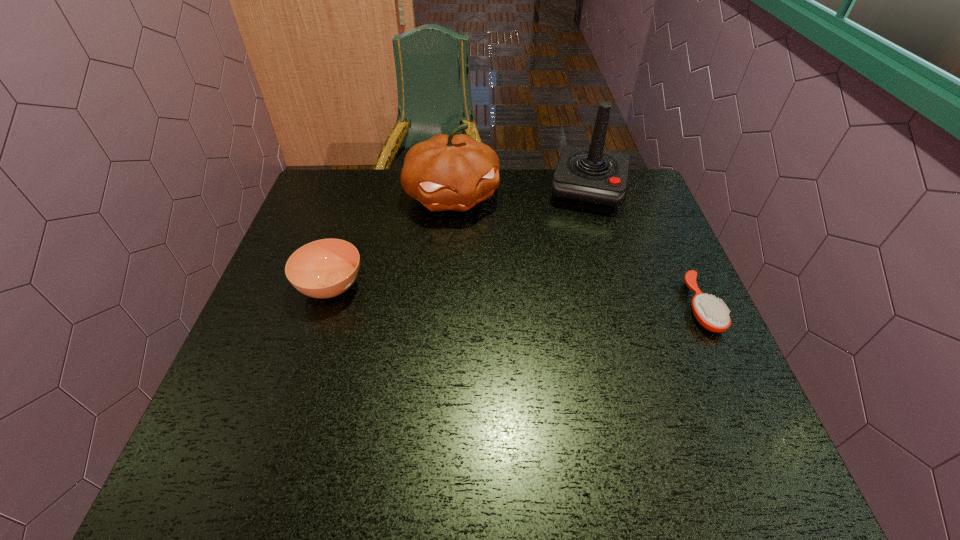
Locate an element on the screen. This screenshot has width=960, height=540. vacant space situated 0.290m on the front face of the third object from right to left is located at coordinates (511, 294).

You are a GUI agent. You are given a task and a screenshot of the screen. Output one action in this format:
    pyautogui.click(x=<x>, y=<y>)
    Task: Click on the vacant point located 0.180m on the front face of the third object from right to left
    The height and width of the screenshot is (540, 960).
    Given the screenshot: What is the action you would take?
    pyautogui.click(x=493, y=265)

You are a GUI agent. You are given a task and a screenshot of the screen. Output one action in this format:
    pyautogui.click(x=<x>, y=<y>)
    Task: Click on the free location located 0.380m on the front face of the third object from right to left
    Image resolution: width=960 pixels, height=540 pixels.
    Given the screenshot: What is the action you would take?
    pyautogui.click(x=527, y=321)

Image resolution: width=960 pixels, height=540 pixels. Identify the location of free location located 0.230m on the front-facing side of the second object from right to left. [x=571, y=268].

The width and height of the screenshot is (960, 540). Find the location of `vacant space situated 0.290m on the front-facing side of the second object from right to left`. vacant space situated 0.290m on the front-facing side of the second object from right to left is located at coordinates (567, 285).

Find the location of a particular element. Image resolution: width=960 pixels, height=540 pixels. vacant space located 0.300m on the front-facing side of the second object from right to left is located at coordinates click(566, 287).

You are a GUI agent. You are given a task and a screenshot of the screen. Output one action in this format:
    pyautogui.click(x=<x>, y=<y>)
    Task: Click on the pumpkin positioned at the far edge
    
    Given the screenshot: What is the action you would take?
    pyautogui.click(x=454, y=172)

I want to click on joystick that is at the far edge, so [x=593, y=178].

This screenshot has height=540, width=960. I want to click on object present at the left edge, so click(x=325, y=268).

At what (x,y) coordinates should I click in order to perform the action: click on hairbrush situated at the right edge. Please return your answer as a coordinate pair (x, y). Image resolution: width=960 pixels, height=540 pixels. Looking at the image, I should click on (710, 313).